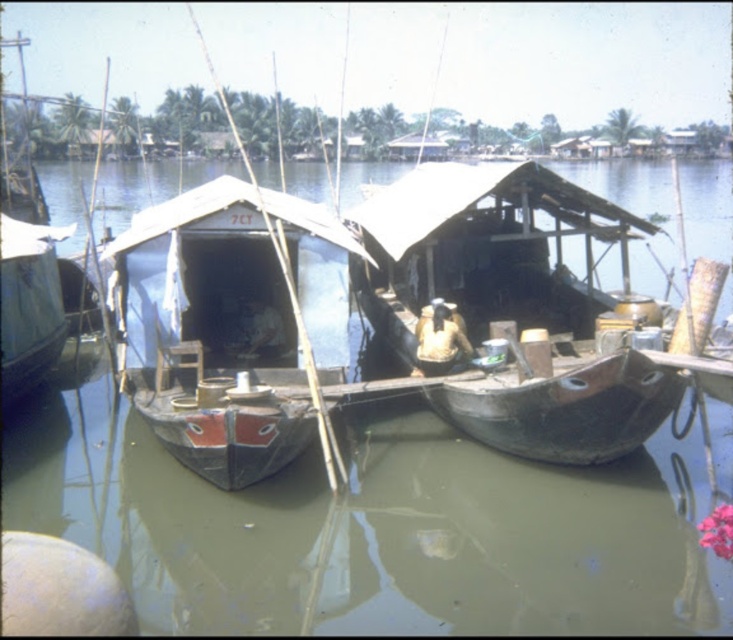
Question: Among these objects, which one is nearest to the camera?

Choices:
 (A) wooden boat at center
 (B) dark brown wooden boat at center
 (C) wooden boat at left

Answer: (A)

Question: Is wooden boat at center further to the viewer compared to wooden boat at left?

Choices:
 (A) no
 (B) yes

Answer: (A)

Question: From the image, what is the correct spatial relationship of wooden boat at center in relation to wooden boat at left?

Choices:
 (A) below
 (B) above

Answer: (A)

Question: Which of the following is the farthest from the observer?

Choices:
 (A) (62, 332)
 (B) (273, 195)

Answer: (B)

Question: Can you confirm if dark brown wooden boat at center is wider than wooden boat at center?

Choices:
 (A) yes
 (B) no

Answer: (A)

Question: Which object is the farthest from the wooden boat at center?

Choices:
 (A) dark brown wooden boat at center
 (B) wooden boat at left

Answer: (B)